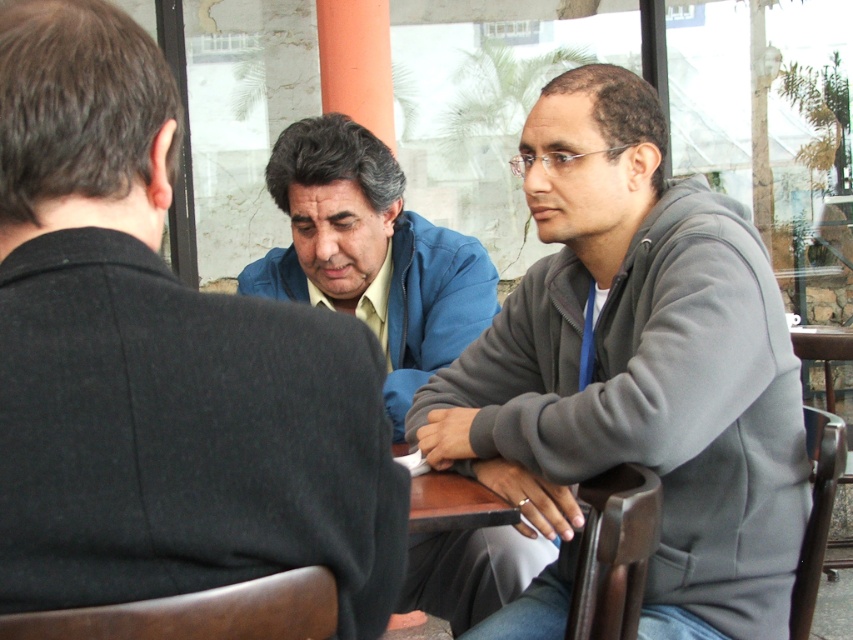
Question: Does blue fabric shirt at center have a lesser width compared to gray fleece jacket at center?

Choices:
 (A) yes
 (B) no

Answer: (A)

Question: Which point is farther to the camera?

Choices:
 (A) gray fleece jacket at center
 (B) blue fabric shirt at center
 (C) brown wooden table at center

Answer: (A)

Question: Among these points, which one is nearest to the camera?

Choices:
 (A) (436, 515)
 (B) (286, 209)

Answer: (A)

Question: Can you confirm if blue fabric shirt at center is thinner than brown wooden table at center?

Choices:
 (A) yes
 (B) no

Answer: (B)

Question: Does gray fleece jacket at center have a smaller size compared to brown wooden table at center?

Choices:
 (A) no
 (B) yes

Answer: (A)

Question: Which of the following is the closest to the observer?

Choices:
 (A) (648, 180)
 (B) (421, 339)

Answer: (A)